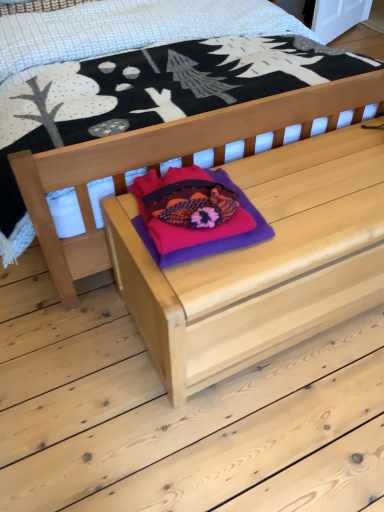
What do you see at coordinates (158, 166) in the screenshot? The width and height of the screenshot is (384, 512). I see `natural wood bed at center` at bounding box center [158, 166].

Describe the element at coordinates (263, 263) in the screenshot. The width and height of the screenshot is (384, 512). I see `natural wood chest at center` at that location.

Image resolution: width=384 pixels, height=512 pixels. Find the location of `purple felt throw pillow at center`. purple felt throw pillow at center is located at coordinates (213, 240).

Could you tell me if purple felt throw pillow at center is facing natural wood chest at center?

No, purple felt throw pillow at center does not turn towards natural wood chest at center.

From a real-world perspective, is purple felt throw pillow at center physically above natural wood chest at center?

Yes, from a real-world perspective, purple felt throw pillow at center is over natural wood chest at center

From the image's perspective, is purple felt throw pillow at center located above natural wood chest at center?

Correct, purple felt throw pillow at center appears higher than natural wood chest at center in the image.

Does purple felt throw pillow at center appear on the left side of natural wood bed at center?

Incorrect, purple felt throw pillow at center is not on the left side of natural wood bed at center.

From the image's perspective, which is below, purple felt throw pillow at center or natural wood bed at center?

From the image's view, purple felt throw pillow at center is below.

In the image, is purple felt throw pillow at center positioned in front of or behind natural wood bed at center?

Visually, purple felt throw pillow at center is located behind natural wood bed at center.

Looking at the image, does natural wood chest at center seem bigger or smaller compared to purple felt throw pillow at center?

natural wood chest at center is bigger than purple felt throw pillow at center.

Based on the photo, who is taller, natural wood chest at center or purple felt throw pillow at center?

natural wood chest at center is taller.

Choose the correct answer: Is natural wood chest at center inside purple felt throw pillow at center or outside it?

natural wood chest at center exists outside the volume of purple felt throw pillow at center.

From a real-world perspective, is natural wood chest at center above or below purple felt throw pillow at center?

From a real-world perspective, natural wood chest at center is physically below purple felt throw pillow at center.

In the image, is natural wood bed at center on the left side or the right side of purple felt throw pillow at center?

Clearly, natural wood bed at center is on the left of purple felt throw pillow at center in the image.

Locate an element on the screen. Image resolution: width=384 pixels, height=512 pixels. throw pillow below the natural wood bed at center (from a real-world perspective) is located at coordinates (213, 240).

From the picture: From a real-world perspective, does natural wood bed at center sit lower than purple felt throw pillow at center?

Actually, natural wood bed at center is physically above purple felt throw pillow at center in the real world.

Is natural wood bed at center with natural wood chest at center?

They are not placed beside each other.

Considering the sizes of objects natural wood bed at center and natural wood chest at center in the image provided, who is thinner, natural wood bed at center or natural wood chest at center?

natural wood chest at center.

Which is correct: natural wood bed at center is inside natural wood chest at center, or outside of it?

The correct answer is: outside.

From the picture: Between natural wood chest at center and natural wood bed at center, which one has less height?

natural wood chest at center is shorter.

Considering the relative sizes of natural wood chest at center and natural wood bed at center in the image provided, is natural wood chest at center smaller than natural wood bed at center?

Yes.

Considering their positions, is natural wood chest at center located in front of or behind natural wood bed at center?

In the image, natural wood chest at center appears behind natural wood bed at center.

From the image's perspective, would you say natural wood chest at center is shown under natural wood bed at center?

Yes, from the image's perspective, natural wood chest at center is beneath natural wood bed at center.

Find the location of a particular element. This screenshot has height=512, width=384. throw pillow that is behind the natural wood chest at center is located at coordinates (213, 240).

At what (x,y) coordinates should I click in order to perform the action: click on throw pillow below the natural wood bed at center (from a real-world perspective). Please return your answer as a coordinate pair (x, y). Looking at the image, I should click on (213, 240).

Estimate the real-world distances between objects in this image. Which object is closer to natural wood chest at center, purple felt throw pillow at center or natural wood bed at center?

purple felt throw pillow at center.

Which object lies nearer to the anchor point natural wood bed at center, natural wood chest at center or purple felt throw pillow at center?

natural wood chest at center is positioned closer to the anchor natural wood bed at center.

Which object lies nearer to the anchor point purple felt throw pillow at center, natural wood chest at center or natural wood bed at center?

Among the two, natural wood chest at center is located nearer to purple felt throw pillow at center.

Estimate the real-world distances between objects in this image. Which object is closer to natural wood bed at center, purple felt throw pillow at center or natural wood chest at center?

Based on the image, natural wood chest at center appears to be nearer to natural wood bed at center.

Which object lies nearer to the anchor point purple felt throw pillow at center, natural wood bed at center or natural wood chest at center?

Among the two, natural wood chest at center is located nearer to purple felt throw pillow at center.

Consider the image. Based on their spatial positions, is natural wood bed at center or purple felt throw pillow at center closer to natural wood chest at center?

purple felt throw pillow at center lies closer to natural wood chest at center than the other object.

The width and height of the screenshot is (384, 512). I want to click on throw pillow between natural wood bed at center and natural wood chest at center in the vertical direction, so click(x=213, y=240).